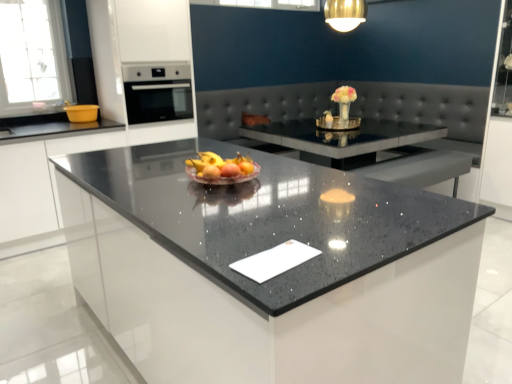
Question: Which is correct: glossy white oven at upper left, which ranks as the 1th cabinetry in right-to-left order, is inside translucent glass bowl at center, or outside of it?

Choices:
 (A) outside
 (B) inside

Answer: (A)

Question: Considering the positions of glossy white oven at upper left, which ranks as the 1th cabinetry in right-to-left order, and translucent glass bowl at center in the image, is glossy white oven at upper left, which ranks as the 1th cabinetry in right-to-left order, bigger or smaller than translucent glass bowl at center?

Choices:
 (A) big
 (B) small

Answer: (A)

Question: Which object is the farthest from the yellow plastic bowl at left?

Choices:
 (A) white glossy cabinet at left, marked as the 2th cabinetry in a right-to-left arrangement
 (B) glossy white oven at upper left, which is the 2th cabinetry from left to right
 (C) translucent glass bowl at center
 (D) gold metallic light fixture at upper center
 (E) black granite countertop at center

Answer: (D)

Question: Which object is the closest to the gold metallic light fixture at upper center?

Choices:
 (A) black granite countertop at center
 (B) white glossy cabinet at left, the 1th cabinetry viewed from the left
 (C) glossy white oven at upper left, which ranks as the 1th cabinetry in right-to-left order
 (D) yellow plastic bowl at left
 (E) satin black oven at upper left

Answer: (E)